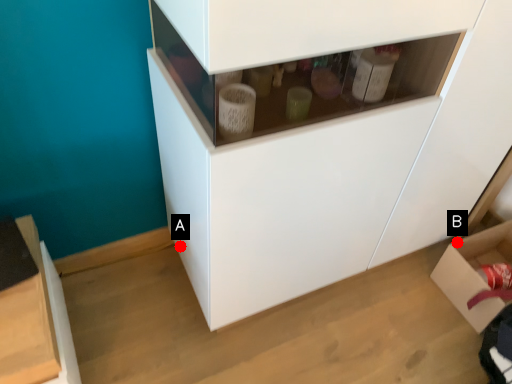
Question: Two points are circled on the image, labeled by A and B beside each circle. Which point is further to the camera?

Choices:
 (A) A is further
 (B) B is further

Answer: (B)